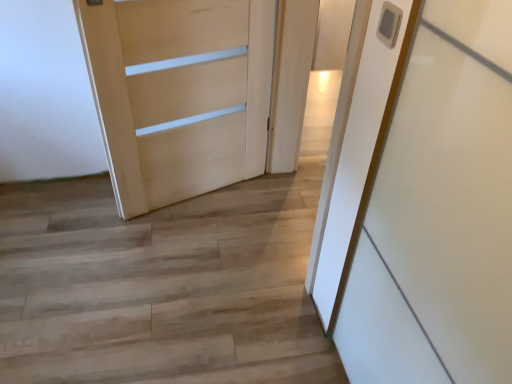
You are a GUI agent. You are given a task and a screenshot of the screen. Output one action in this format:
    pyautogui.click(x=<x>, y=<y>)
    Task: Click on the vacant location below light wood door at center, which appears as the 2th door when viewed from the right (from a real-world perspective)
    This screenshot has height=384, width=512.
    Given the screenshot: What is the action you would take?
    coord(196,199)